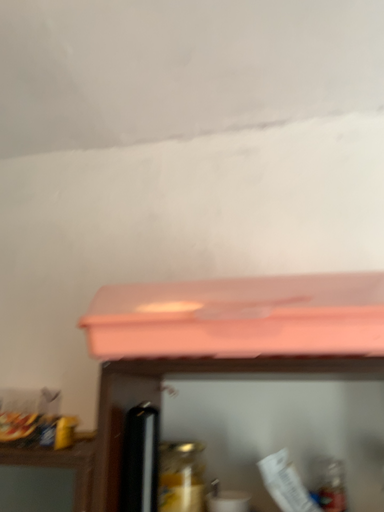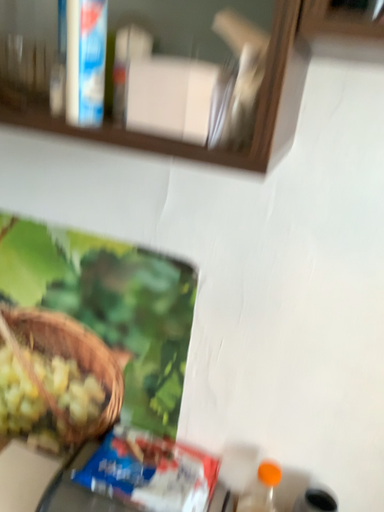
Question: Which way did the camera rotate in the video?

Choices:
 (A) rotated left
 (B) rotated right

Answer: (A)